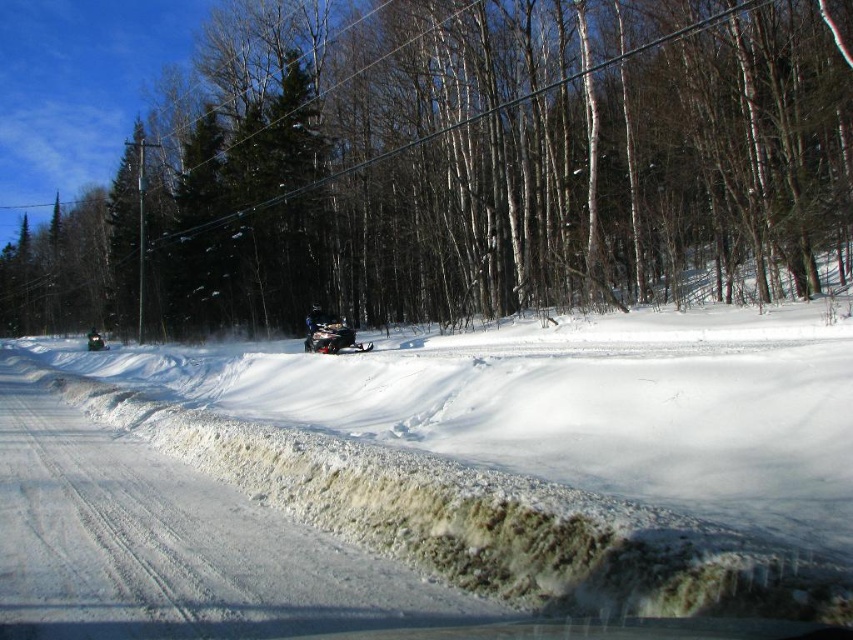
Question: Is white snow ski slope at left smaller than shiny silver snowmobile at center?

Choices:
 (A) no
 (B) yes

Answer: (A)

Question: Which of the following is the farthest from the observer?

Choices:
 (A) brown wood tree at center
 (B) shiny silver snowmobile at center
 (C) shiny black snowmobile at center
 (D) white snow ski slope at left

Answer: (C)

Question: Which is farther from the white snow ski slope at left?

Choices:
 (A) shiny black snowmobile at center
 (B) brown wood tree at center
 (C) shiny silver snowmobile at center

Answer: (A)

Question: Does brown wood tree at center lie behind white snow ski slope at left?

Choices:
 (A) yes
 (B) no

Answer: (A)

Question: Which point is farther to the camera?

Choices:
 (A) shiny silver snowmobile at center
 (B) brown wood tree at center
 (C) white snow ski slope at left
 (D) shiny black snowmobile at center

Answer: (D)

Question: Is white snow ski slope at left thinner than shiny black snowmobile at center?

Choices:
 (A) yes
 (B) no

Answer: (B)